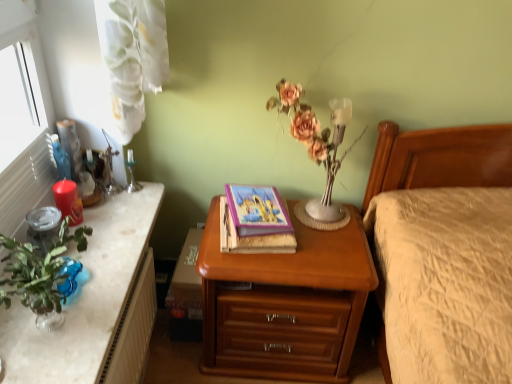
Question: Considering their positions, is silver metallic candle holder at upper left located in front of or behind green marble desk at left?

Choices:
 (A) front
 (B) behind

Answer: (B)

Question: Considering the positions of point (129, 168) and point (66, 344), is point (129, 168) closer or farther from the camera than point (66, 344)?

Choices:
 (A) farther
 (B) closer

Answer: (A)

Question: Which object is positioned farthest from the green marble desk at left?

Choices:
 (A) matte pink flowers at center
 (B) matte purple book at center
 (C) wooden nightstand at center
 (D) white textured radiator at lower left
 (E) matte red candle at left

Answer: (A)

Question: Considering the real-world distances, which object is closest to the green marble desk at left?

Choices:
 (A) matte red candle at left
 (B) matte purple book at center
 (C) silver metallic candle holder at upper left
 (D) white textured radiator at lower left
 (E) matte pink flowers at center

Answer: (D)